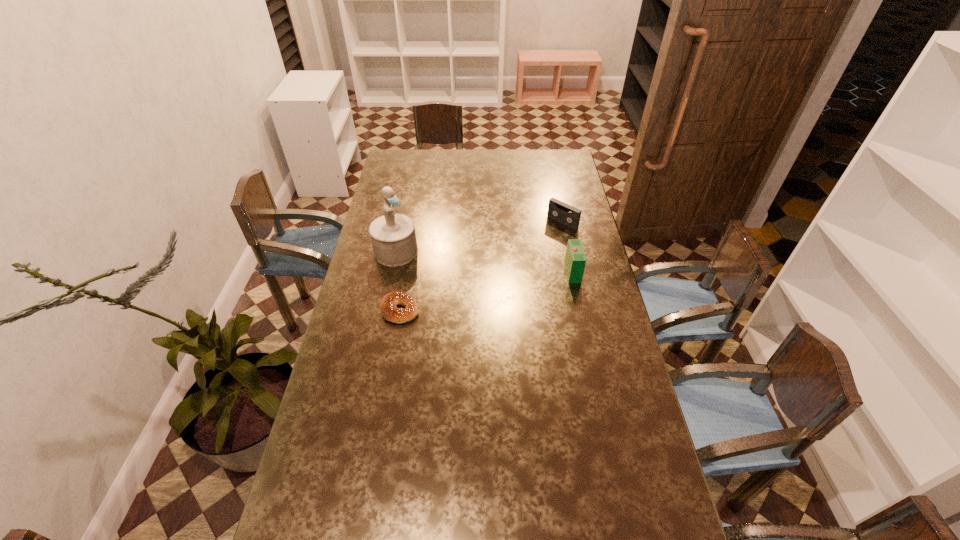
Find the location of a particular element. Image resolution: width=960 pixels, height=540 pixels. free space at the right edge of the desktop is located at coordinates (586, 271).

The height and width of the screenshot is (540, 960). I want to click on vacant space at the far left corner of the desktop, so click(x=393, y=153).

The width and height of the screenshot is (960, 540). I want to click on vacant space at the near right corner, so click(x=638, y=516).

Locate an element on the screen. The image size is (960, 540). free point between the figurine and the nearest object is located at coordinates (398, 281).

You are a GUI agent. You are given a task and a screenshot of the screen. Output one action in this format:
    pyautogui.click(x=<x>, y=<y>)
    Task: Click on the free space between the figurine and the alarm clock
    This screenshot has width=960, height=540.
    Given the screenshot: What is the action you would take?
    pyautogui.click(x=485, y=262)

You are a GUI agent. You are given a task and a screenshot of the screen. Output one action in this format:
    pyautogui.click(x=<x>, y=<y>)
    Task: Click on the unoccupied position between the bagel and the farthest object
    The width and height of the screenshot is (960, 540).
    Given the screenshot: What is the action you would take?
    pyautogui.click(x=481, y=266)

Find the location of a particular element. The image size is (960, 540). vacant area between the figurine and the videotape is located at coordinates (479, 237).

In order to click on empty space between the tallest object and the second shortest object in this screenshot , I will do `click(479, 237)`.

Find the location of `free space between the videotape and the figurine`. free space between the videotape and the figurine is located at coordinates (479, 237).

At what (x,y) coordinates should I click in order to perform the action: click on free space between the tallest object and the alarm clock. Please return your answer as a coordinate pair (x, y). Looking at the image, I should click on (485, 262).